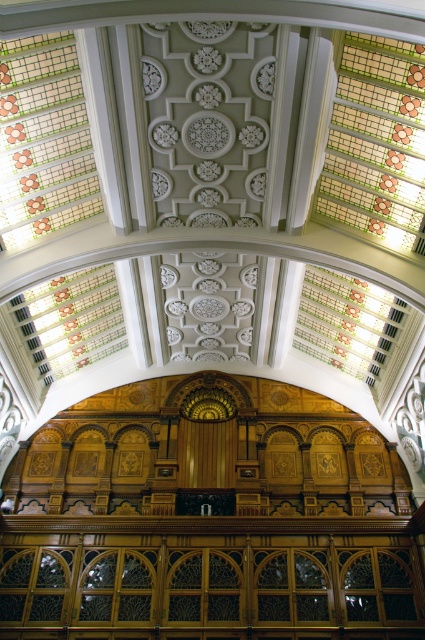
Identify the location of clear glass window at center. This screenshot has height=640, width=425. (210, 592).

Does point (20, 595) lie in front of point (88, 204)?

No, (20, 595) is behind (88, 204).

Is point (226, 557) positioned after point (8, 193)?

Yes, point (226, 557) is behind point (8, 193).

Where is `clear glass window at center`? clear glass window at center is located at coordinates (210, 592).

The width and height of the screenshot is (425, 640). Identify the location of clear glass window at center. (210, 592).

Does point (17, 554) come closer to viewer compared to point (359, 90)?

No, (17, 554) is behind (359, 90).

This screenshot has height=640, width=425. What are the coordinates of `clear glass window at center` in the screenshot? It's located at (210, 592).

Does point (390, 237) come farther from viewer compared to point (5, 216)?

Yes, point (390, 237) is farther from viewer.

In the scene shown: Is stained glass window at upper center positioned in front of stained glass window at upper left?

No, stained glass window at upper center is behind stained glass window at upper left.

Is point (416, 108) farther from viewer compared to point (82, 150)?

No, it is in front of (82, 150).

This screenshot has height=640, width=425. Identify the location of stained glass window at upper center. (376, 141).